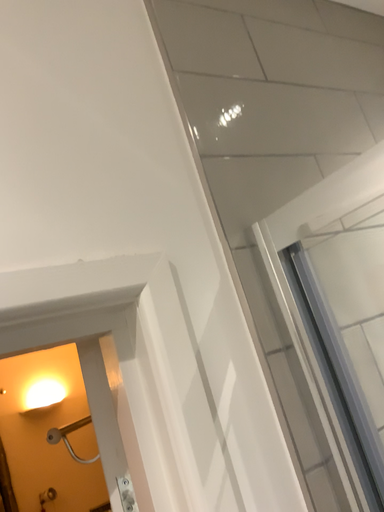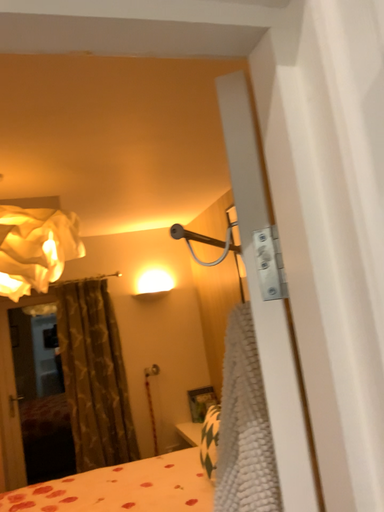
Question: Which way did the camera rotate in the video?

Choices:
 (A) rotated upward
 (B) rotated downward

Answer: (B)